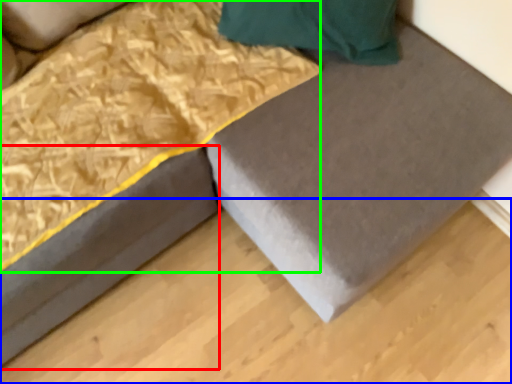
Question: Estimate the real-world distances between objects in this image. Which object is closer to bed frame (highlighted by a red box), plywood (highlighted by a blue box) or blanket (highlighted by a green box)?

Choices:
 (A) plywood
 (B) blanket

Answer: (B)